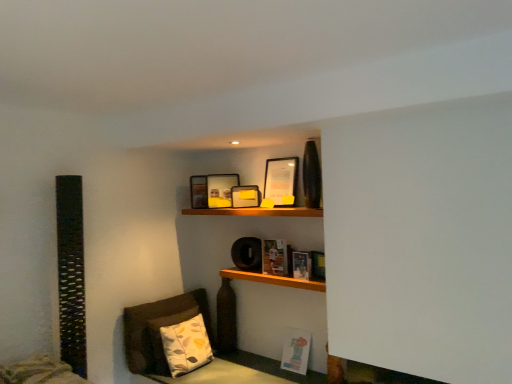
Question: Is matte paper book at center, which ranks as the 3th book in bottom-to-top order, in front of matte yellow picture frame at upper center, marked as the second picture frame in a back-to-front arrangement?

Choices:
 (A) yes
 (B) no

Answer: (A)

Question: Is matte paper book at center, the 1th book viewed from the top, wider than matte yellow picture frame at upper center, the third picture frame in the front-to-back sequence?

Choices:
 (A) no
 (B) yes

Answer: (B)

Question: From a real-world perspective, is matte paper book at center, the 1th book viewed from the top, physically above matte yellow picture frame at upper center, marked as the second picture frame in a back-to-front arrangement?

Choices:
 (A) yes
 (B) no

Answer: (B)

Question: Considering the relative positions of matte paper book at center, the 1th book viewed from the top, and matte yellow picture frame at upper center, marked as the second picture frame in a back-to-front arrangement, in the image provided, is matte paper book at center, the 1th book viewed from the top, to the right of matte yellow picture frame at upper center, marked as the second picture frame in a back-to-front arrangement, from the viewer's perspective?

Choices:
 (A) yes
 (B) no

Answer: (A)

Question: Is matte paper book at center, the 1th book viewed from the top, positioned with its back to matte yellow picture frame at upper center, the third picture frame in the front-to-back sequence?

Choices:
 (A) no
 (B) yes

Answer: (A)

Question: From the image's perspective, is printed fabric pillow at lower left located above or below matte black picture frame at upper center, which is counted as the 4th picture frame, starting from the front?

Choices:
 (A) above
 (B) below

Answer: (B)

Question: Is printed fabric pillow at lower left wider or thinner than matte black picture frame at upper center, which is counted as the 4th picture frame, starting from the front?

Choices:
 (A) thin
 (B) wide

Answer: (B)

Question: Is printed fabric pillow at lower left bigger or smaller than matte black picture frame at upper center, which is the 1th picture frame in back-to-front order?

Choices:
 (A) small
 (B) big

Answer: (B)

Question: Based on their positions, is printed fabric pillow at lower left located to the left or right of matte black picture frame at upper center, which is counted as the 4th picture frame, starting from the front?

Choices:
 (A) right
 (B) left

Answer: (B)

Question: Looking at the image, does matte black picture frame at upper center, which is the fourth picture frame from back to front, seem bigger or smaller compared to printed fabric pillow at lower left?

Choices:
 (A) big
 (B) small

Answer: (B)

Question: Considering their positions, is matte black picture frame at upper center, which is the fourth picture frame from back to front, located in front of or behind printed fabric pillow at lower left?

Choices:
 (A) front
 (B) behind

Answer: (B)

Question: Does point (281, 185) appear closer or farther from the camera than point (181, 317)?

Choices:
 (A) closer
 (B) farther

Answer: (A)

Question: From a real-world perspective, is matte black picture frame at upper center, which is counted as the first picture frame, starting from the front, above or below printed fabric pillow at lower left?

Choices:
 (A) above
 (B) below

Answer: (A)

Question: Is matte yellow picture frame at upper center, marked as the second picture frame in a back-to-front arrangement, bigger or smaller than matte black picture frame at upper center, which is counted as the 4th picture frame, starting from the front?

Choices:
 (A) big
 (B) small

Answer: (A)

Question: Is matte yellow picture frame at upper center, marked as the second picture frame in a back-to-front arrangement, in front of or behind matte black picture frame at upper center, which is the 1th picture frame in back-to-front order, in the image?

Choices:
 (A) front
 (B) behind

Answer: (A)